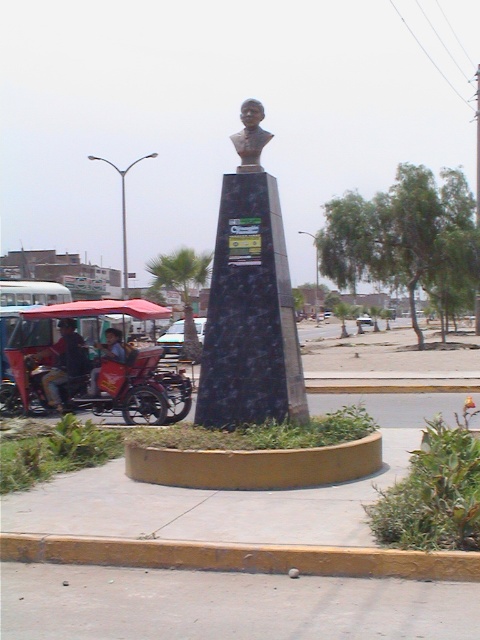
You are a delivery person who needs to park your metallic red cart at left near the monument. The sandy brown bust at center is in the way. Can you park the cart without moving the bust?

The sandy brown bust at center is larger in size than the metallic red cart at left, but since the bust is on top of a tall pedestal, there is enough space below it to park the metallic red cart at left without moving the bust.

You are standing in front of the monument and want to place a small flowerpot exactly 5 meters away from where you are standing. The yellow concrete curb at lower center is in your path. Can you place the flowerpot beyond the curb?

The yellow concrete curb at lower center is 4.92 meters from viewer, so yes, you can place the flowerpot beyond the curb since it is slightly closer than 5 meters, allowing space to place it further away.